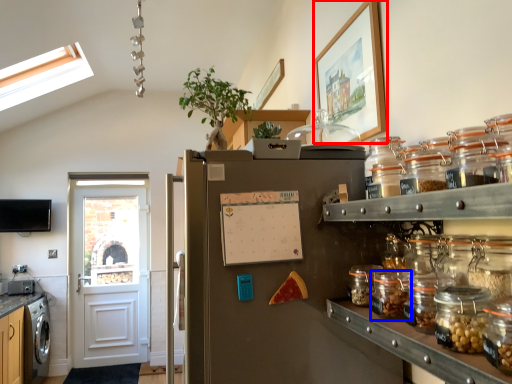
Question: Which of the following is the closest to the observer, picture frame (highlighted by a red box) or glass jar (highlighted by a blue box)?

Choices:
 (A) picture frame
 (B) glass jar

Answer: (B)